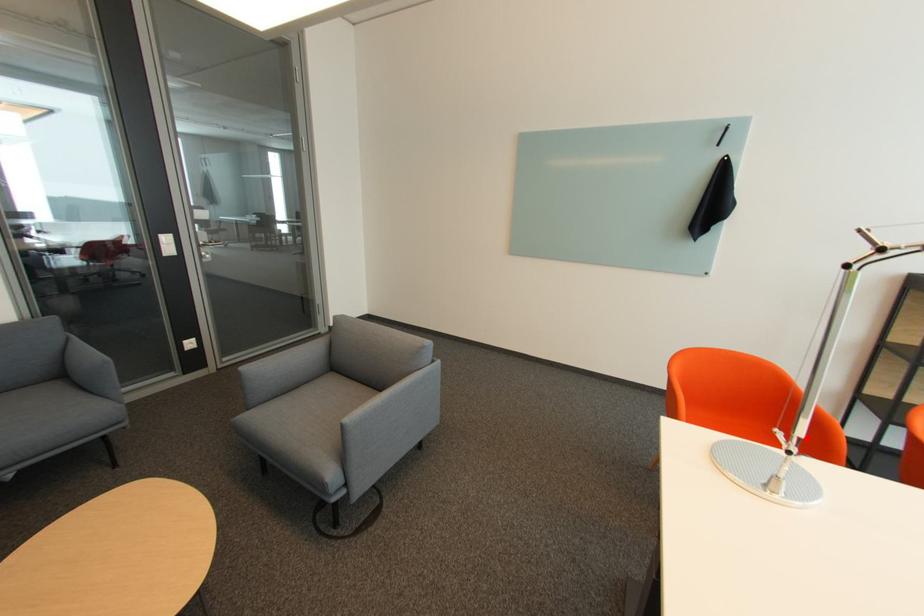
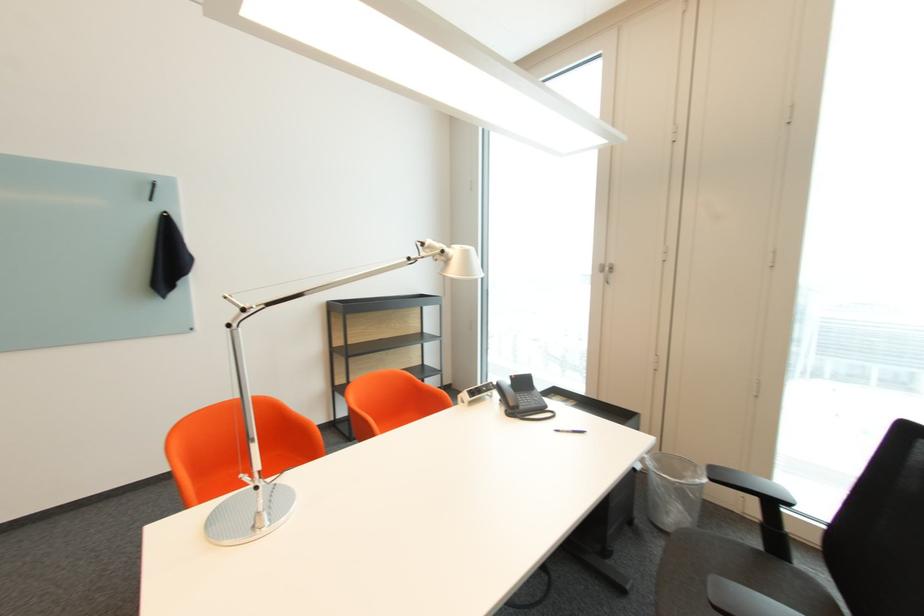
Where in the second image is the point corresponding to the highlighted location from the first image?

(265, 472)